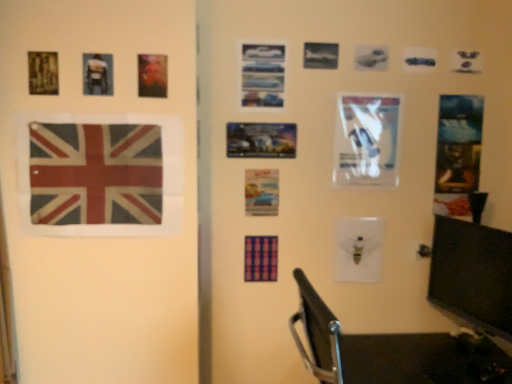
At what (x,y) coordinates should I click in order to perform the action: click on textured fabric flag at left. Please return your answer as a coordinate pair (x, y). The image size is (512, 384). Looking at the image, I should click on (95, 174).

From the image's perspective, which is below, metallic silver poster at right, the 1th postcard positioned from the back, or metallic silver poster at center, the 2th picture frame in the front-to-back sequence?

metallic silver poster at right, the 1th postcard positioned from the back, appears lower in the image.

Is metallic silver poster at right, the 1th postcard positioned from the back, in front of or behind metallic silver poster at center, the 2th picture frame in the front-to-back sequence, in the image?

Clearly, metallic silver poster at right, the 1th postcard positioned from the back, is behind metallic silver poster at center, the 2th picture frame in the front-to-back sequence.

Can you confirm if metallic silver poster at right, arranged as the 5th postcard when viewed from the left, is thinner than metallic silver poster at center, the 1th picture frame in the bottom-to-top sequence?

Yes.

Is metallic silver poster at right, the 1th postcard positioned from the back, looking in the opposite direction of metallic silver poster at center, the 1th picture frame in the bottom-to-top sequence?

No, metallic silver poster at right, the 1th postcard positioned from the back,'s orientation is not away from metallic silver poster at center, the 1th picture frame in the bottom-to-top sequence.

Does point (274, 205) come behind point (267, 56)?

Yes, it is.

Is pastel paper postcard at center, which appears as the 2th postcard when viewed from the left, not within metallic blue postcard at upper center, the second postcard from the front?

Indeed, pastel paper postcard at center, which appears as the 2th postcard when viewed from the left, is completely outside metallic blue postcard at upper center, the second postcard from the front.

Is pastel paper postcard at center, which is the 2th postcard in back-to-front order, positioned with its back to metallic blue postcard at upper center, the second postcard from the front?

No, pastel paper postcard at center, which is the 2th postcard in back-to-front order, is not facing the opposite direction of metallic blue postcard at upper center, the second postcard from the front.

Considering the relative sizes of pastel paper postcard at center, marked as the 4th postcard in a front-to-back arrangement, and metallic blue postcard at upper center, which ranks as the third postcard in left-to-right order, in the image provided, is pastel paper postcard at center, marked as the 4th postcard in a front-to-back arrangement, bigger than metallic blue postcard at upper center, which ranks as the third postcard in left-to-right order,?

No.

Looking at this image, could you tell me if black glossy monitor at right is turned towards metallic blue postcard at upper center, the 4th postcard viewed from the back?

No, black glossy monitor at right is not facing towards metallic blue postcard at upper center, the 4th postcard viewed from the back.

Is point (466, 265) behind point (266, 61)?

No.

Can you tell me how much black glossy monitor at right and metallic blue postcard at upper center, which ranks as the third postcard in left-to-right order, differ in facing direction?

72.9 degrees.

Could metallic blue postcard at upper center, which ranks as the third postcard in left-to-right order, be considered to be inside black glossy monitor at right?

No, metallic blue postcard at upper center, which ranks as the third postcard in left-to-right order, is not surrounded by black glossy monitor at right.

Could you measure the distance between textured fabric flag at left and metallic blue postcard at upper center, the second postcard from the front?

They are 25.17 inches apart.

From a real-world perspective, between textured fabric flag at left and metallic blue postcard at upper center, the 3th postcard positioned from the right, who is vertically higher?

From a 3D spatial view, metallic blue postcard at upper center, the 3th postcard positioned from the right, is above.

Is textured fabric flag at left taller than metallic blue postcard at upper center, which ranks as the third postcard in left-to-right order?

Indeed, textured fabric flag at left has a greater height compared to metallic blue postcard at upper center, which ranks as the third postcard in left-to-right order.

Which is in front, point (75, 182) or point (248, 43)?

The point (75, 182) is in front.

Is metallic silver poster at right, the 1th postcard positioned from the back, directly adjacent to metallic blue postcard at upper center, the 3th postcard positioned from the right?

No, metallic silver poster at right, the 1th postcard positioned from the back, is not in contact with metallic blue postcard at upper center, the 3th postcard positioned from the right.

From a real-world perspective, who is located higher, metallic silver poster at right, the 1th postcard positioned from the back, or metallic blue postcard at upper center, which ranks as the third postcard in left-to-right order?

From a 3D spatial view, metallic blue postcard at upper center, which ranks as the third postcard in left-to-right order, is above.

Considering the relative sizes of metallic silver poster at right, the 1th postcard positioned from the back, and metallic blue postcard at upper center, the 3th postcard positioned from the right, in the image provided, is metallic silver poster at right, the 1th postcard positioned from the back, bigger than metallic blue postcard at upper center, the 3th postcard positioned from the right,?

Yes.

In the scene shown: Is metallic silver poster at right, the 1th postcard positioned from the back, not within metallic blue postcard at upper center, the second postcard from the front?

Yes, metallic silver poster at right, the 1th postcard positioned from the back, is outside of metallic blue postcard at upper center, the second postcard from the front.

Consider the image. Between black glossy monitor at right and shiny metallic postcard at upper left, the 1th postcard viewed from the left, which one appears on the right side from the viewer's perspective?

Positioned to the right is black glossy monitor at right.

Can you confirm if black glossy monitor at right is shorter than shiny metallic postcard at upper left, which appears as the fifth postcard when viewed from the right?

No, black glossy monitor at right is not shorter than shiny metallic postcard at upper left, which appears as the fifth postcard when viewed from the right.

Between black glossy monitor at right and shiny metallic postcard at upper left, the 1th postcard viewed from the left, which one has smaller width?

Thinner between the two is shiny metallic postcard at upper left, the 1th postcard viewed from the left.

Is point (492, 228) more distant than point (138, 64)?

Yes, point (492, 228) is behind point (138, 64).

Do you think matte black backpack at upper left, positioned as the 2th picture frame in right-to-left order, is within black glossy monitor at right, or outside of it?

matte black backpack at upper left, positioned as the 2th picture frame in right-to-left order, lies outside black glossy monitor at right.

From the image's perspective, is matte black backpack at upper left, placed as the 2th picture frame when sorted from back to front, above black glossy monitor at right?

Yes, from the image's perspective, matte black backpack at upper left, placed as the 2th picture frame when sorted from back to front, is over black glossy monitor at right.

Between matte black backpack at upper left, positioned as the 2th picture frame in right-to-left order, and black glossy monitor at right, which one has larger width?

black glossy monitor at right.

From their relative heights in the image, would you say matte black backpack at upper left, marked as the 1th picture frame in a left-to-right arrangement, is taller or shorter than black glossy monitor at right?

matte black backpack at upper left, marked as the 1th picture frame in a left-to-right arrangement, is shorter than black glossy monitor at right.

This screenshot has width=512, height=384. Identify the location of the 1st picture frame above the metallic silver poster at right, arranged as the 5th postcard when viewed from the left (from a real-world perspective). (261, 140).

Locate an element on the screen. This screenshot has height=384, width=512. the 1st postcard to the left when counting from the metallic blue postcard at upper center, which ranks as the third postcard in left-to-right order is located at coordinates coord(261,192).

Which object lies nearer to the anchor point shiny metallic postcard at upper left, positioned as the first postcard in front-to-back order, matte black backpack at upper left, positioned as the 2th picture frame in right-to-left order, or white glossy paper at center right, the fourth postcard positioned from the left?

matte black backpack at upper left, positioned as the 2th picture frame in right-to-left order, lies closer to shiny metallic postcard at upper left, positioned as the first postcard in front-to-back order, than the other object.

Estimate the real-world distances between objects in this image. Which object is further from metallic silver poster at center, marked as the second picture frame in a top-to-bottom arrangement, metallic silver poster at right, the 1th postcard positioned from the back, or pastel paper postcard at center, which is the 2th postcard in back-to-front order?

Based on the image, metallic silver poster at right, the 1th postcard positioned from the back, appears to be further to metallic silver poster at center, marked as the second picture frame in a top-to-bottom arrangement.

Estimate the real-world distances between objects in this image. Which object is further from white glossy paper at center right, which ranks as the 3th postcard in back-to-front order, black glossy monitor at right or metallic silver poster at right, the 1th postcard positioned from the right?

black glossy monitor at right.

Looking at the image, which one is located further to shiny metallic postcard at upper left, which appears as the fifth postcard when viewed from the right, metallic silver poster at right, the 1th postcard positioned from the right, or black glossy monitor at right?

Based on the image, black glossy monitor at right appears to be further to shiny metallic postcard at upper left, which appears as the fifth postcard when viewed from the right.

Estimate the real-world distances between objects in this image. Which object is closer to textured fabric flag at left, matte black backpack at upper left, which ranks as the second picture frame in bottom-to-top order, or white glossy paper at center right, the 2th postcard viewed from the right?

matte black backpack at upper left, which ranks as the second picture frame in bottom-to-top order, lies closer to textured fabric flag at left than the other object.

Estimate the real-world distances between objects in this image. Which object is closer to shiny metallic postcard at upper left, positioned as the first postcard in front-to-back order, black glossy monitor at right or metallic silver poster at center, marked as the 1th picture frame in a right-to-left arrangement?

Based on the image, metallic silver poster at center, marked as the 1th picture frame in a right-to-left arrangement, appears to be nearer to shiny metallic postcard at upper left, positioned as the first postcard in front-to-back order.

From the image, which object appears to be nearer to matte black backpack at upper left, which ranks as the second picture frame in bottom-to-top order, white glossy paper at center right, which ranks as the 3th postcard in back-to-front order, or metallic blue postcard at upper center, the second postcard from the front?

metallic blue postcard at upper center, the second postcard from the front, is positioned closer to the anchor matte black backpack at upper left, which ranks as the second picture frame in bottom-to-top order.

Estimate the real-world distances between objects in this image. Which object is closer to metallic silver poster at center, marked as the 1th picture frame in a right-to-left arrangement, metallic silver poster at right, the 1th postcard positioned from the right, or metallic blue postcard at upper center, the 4th postcard viewed from the back?

metallic blue postcard at upper center, the 4th postcard viewed from the back, lies closer to metallic silver poster at center, marked as the 1th picture frame in a right-to-left arrangement, than the other object.

Find the location of a particular element. This screenshot has height=384, width=512. picture frame situated between textured fabric flag at left and metallic silver poster at center, which appears as the second picture frame when viewed from the left, from left to right is located at coordinates tap(98, 74).

Locate an element on the screen. Image resolution: width=512 pixels, height=384 pixels. picture frame located between shiny metallic postcard at upper left, the 1th postcard viewed from the left, and pastel paper postcard at center, which is the 2th postcard in back-to-front order, in the left-right direction is located at coordinates (261, 140).

You are a GUI agent. You are given a task and a screenshot of the screen. Output one action in this format:
    pyautogui.click(x=<x>, y=<y>)
    Task: Click on the computer monitor between metallic silver poster at center, which appears as the second picture frame when viewed from the left, and metallic silver poster at right, arranged as the 5th postcard when viewed from the left, in the horizontal direction
    
    Given the screenshot: What is the action you would take?
    pyautogui.click(x=472, y=274)

The width and height of the screenshot is (512, 384). Find the location of `picture frame situated between matte black backpack at upper left, marked as the 1th picture frame in a left-to-right arrangement, and black glossy monitor at right from left to right`. picture frame situated between matte black backpack at upper left, marked as the 1th picture frame in a left-to-right arrangement, and black glossy monitor at right from left to right is located at coordinates (261, 140).